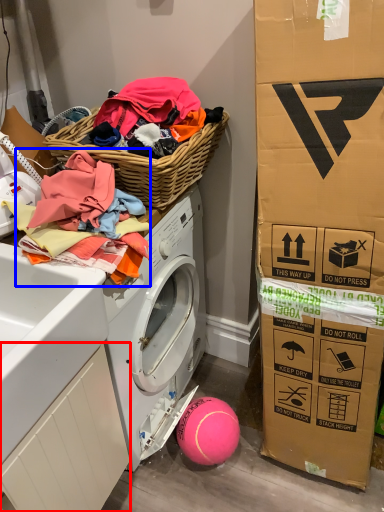
Question: Which object appears farthest to the camera in this image, drawer (highlighted by a red box) or clothing (highlighted by a blue box)?

Choices:
 (A) drawer
 (B) clothing

Answer: (B)